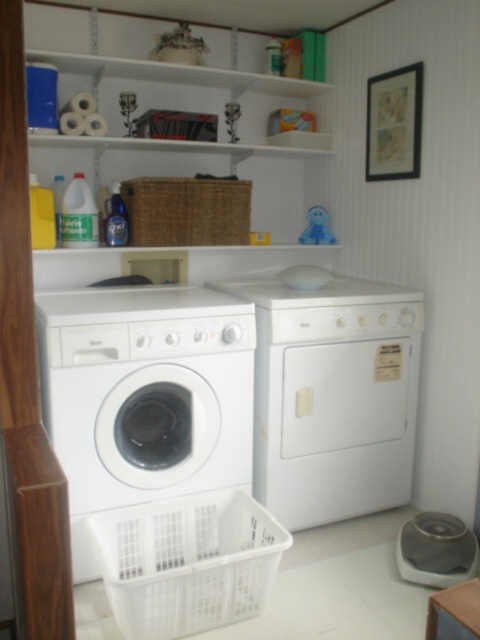
You are organizing the laundry room and want to place the white plastic basket at lower center on the shelf above the white matte dryer at center. The shelf is exactly the same width as the dryer. Will the basket fit on the shelf?

The white plastic basket at lower center is narrower than the white matte dryer at center, and since the shelf matches the dryer width, the basket will fit.

You need to place a new laundry detergent box next to the white plastic basket at lower center. Considering the white matte dryer at center is larger, will there be enough space between them to fit the detergent box?

The white matte dryer at center is larger in size than the white plastic basket at lower center, so there is sufficient space between them to place the detergent box.

You are organizing the laundry room and want to place a new detergent bottle between the white matte washing machine at center and the white plastic basket at lower center. Based on their positions, where should you place the detergent bottle?

The detergent bottle should be placed between the white matte washing machine at center and the white plastic basket at lower center, since the washing machine is above the basket. This means the detergent bottle can be placed on the shelf or surface between them, ensuring it is accessible near both appliances.